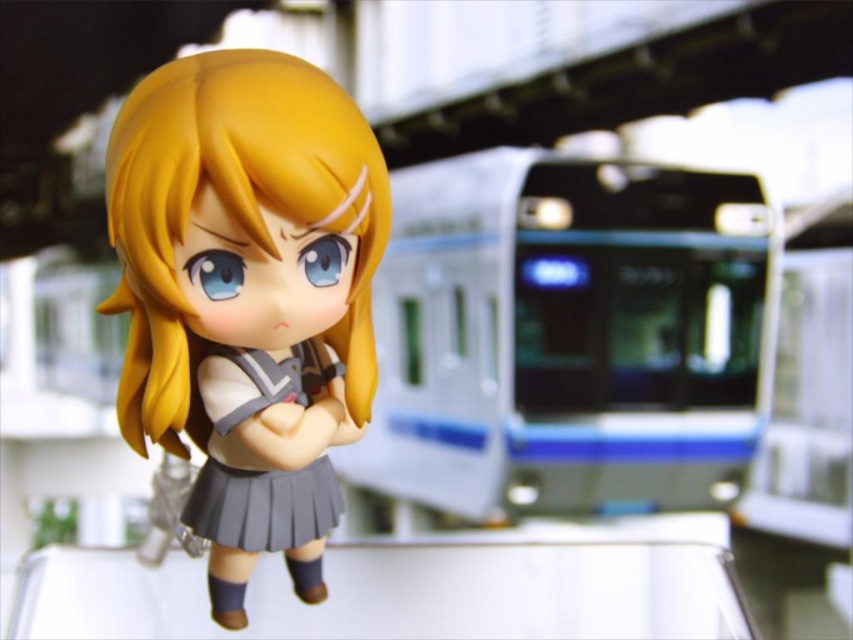
You are a photographer trying to capture the metallic silver train at center and the gray pleated skirt at center in a single shot. Which object should you focus on to ensure both are in frame without zooming in or out?

The metallic silver train at center is bigger than the gray pleated skirt at center, so focusing on the metallic silver train at center will ensure both are in frame without needing to adjust the zoom.

You are standing in a train station and want to place a small gift box on the floor between the metallic silver train at center and the matte plastic doll at center. Can you fit the gift box there?

The metallic silver train at center is located above the matte plastic doll at center, so there is no space between them on the floor. You cannot fit the gift box there.

You are designing a display case for a toy store. The display case has a width limit of 15 centimeters. You have the matte plastic doll at center and the gray pleated skirt at center. Can both items fit side by side within the display case without exceeding the width limit?

The matte plastic doll at center is wider than the gray pleated skirt at center. To determine if both can fit, we need to know their exact widths. However, since the doll is wider, if its width alone is under 15 cm, both might fit. If the doll exceeds 15 cm, they cannot. The given information doesn